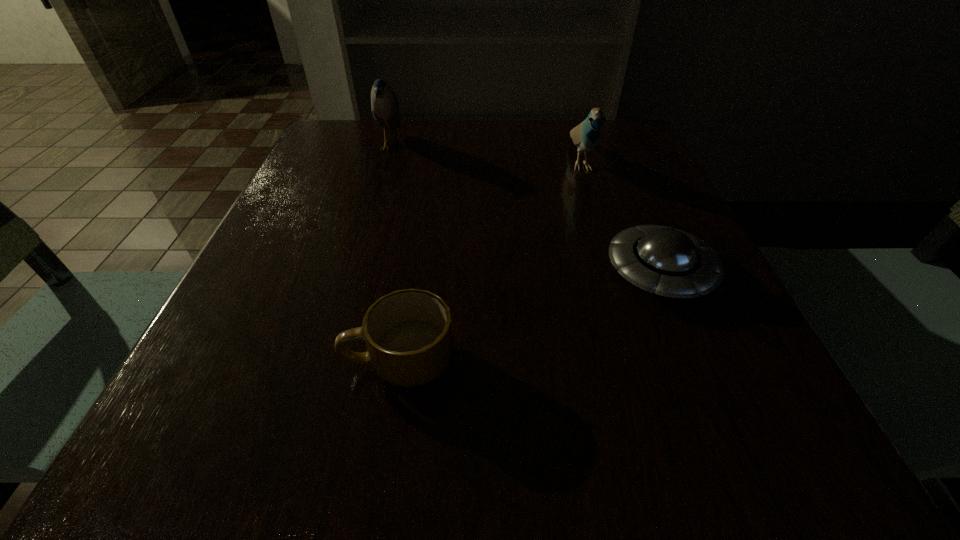
This screenshot has width=960, height=540. Find the location of `vacant space that satisfies the following two spatial constraints: 1. at the tip of the leftmost object's beak; 2. on the left side of the saucer`. vacant space that satisfies the following two spatial constraints: 1. at the tip of the leftmost object's beak; 2. on the left side of the saucer is located at coordinates (351, 272).

You are a GUI agent. You are given a task and a screenshot of the screen. Output one action in this format:
    pyautogui.click(x=<x>, y=<y>)
    Task: Click on the vacant area that satisfies the following two spatial constraints: 1. at the tip of the second nearest object's beak; 2. on the right side of the left bird
    
    Given the screenshot: What is the action you would take?
    pyautogui.click(x=351, y=272)

Where is `free space in the image that satisfies the following two spatial constraints: 1. at the tip of the left bird's beak; 2. on the side with the handle of the mug`? The width and height of the screenshot is (960, 540). free space in the image that satisfies the following two spatial constraints: 1. at the tip of the left bird's beak; 2. on the side with the handle of the mug is located at coordinates (324, 361).

Locate an element on the screen. free space that satisfies the following two spatial constraints: 1. on the side with the handle of the nearest object; 2. at the tip of the leftmost object's beak is located at coordinates (434, 146).